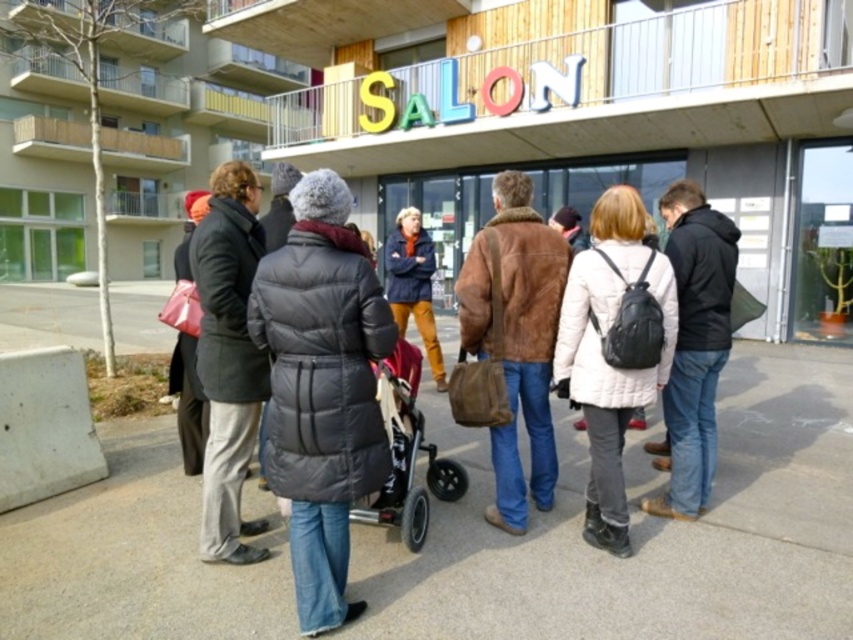
Question: Can you confirm if brown fur coat at center is smaller than metallic gray stroller at center?

Choices:
 (A) no
 (B) yes

Answer: (B)

Question: Which object appears farthest from the camera in this image?

Choices:
 (A) matte blue coat at center
 (B) brown fur coat at center
 (C) dark gray puffy jacket at center
 (D) white puffer jacket at center

Answer: (A)

Question: Does gray asphalt pavement at center come in front of dark gray puffy jacket at center?

Choices:
 (A) yes
 (B) no

Answer: (A)

Question: Considering the relative positions of white puffer jacket at center and matte blue coat at center in the image provided, where is white puffer jacket at center located with respect to matte blue coat at center?

Choices:
 (A) right
 (B) left

Answer: (A)

Question: Which point is farther from the camera taking this photo?

Choices:
 (A) (425, 294)
 (B) (714, 256)
 (C) (354, 292)
 (D) (410, 444)

Answer: (A)

Question: Which point is farther from the camera taking this photo?

Choices:
 (A) (618, 196)
 (B) (247, 616)
 (C) (418, 531)
 (D) (711, 342)

Answer: (D)